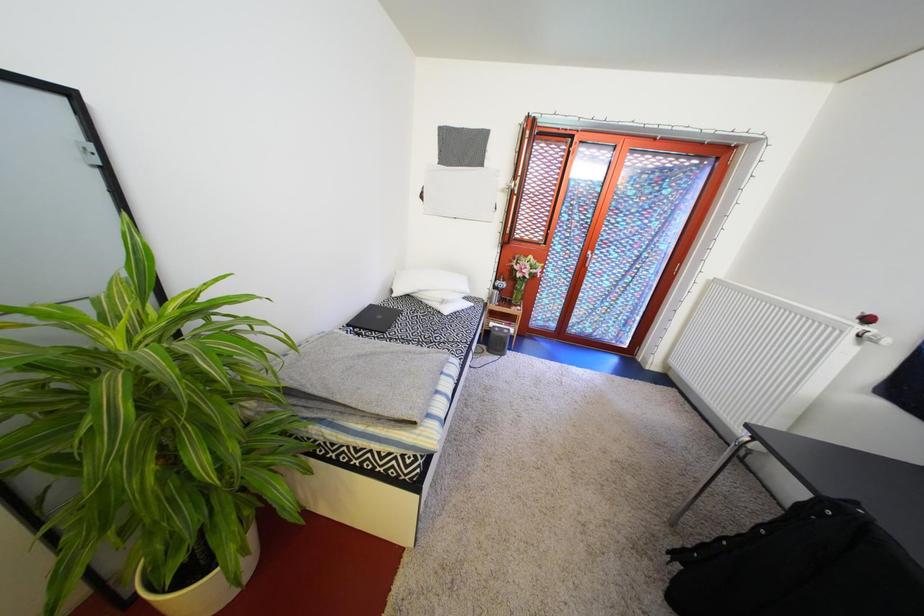
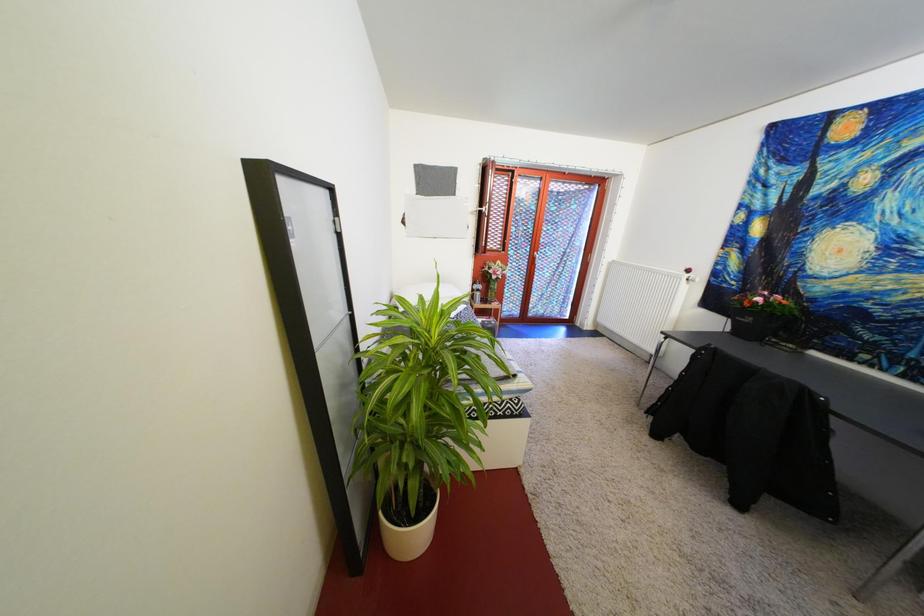
Question: The camera is either moving clockwise (left) or counter-clockwise (right) around the object. The first image is from the beginning of the video and the second image is from the end. Is the camera moving left or right when shooting the video?

Choices:
 (A) Left
 (B) Right

Answer: (A)